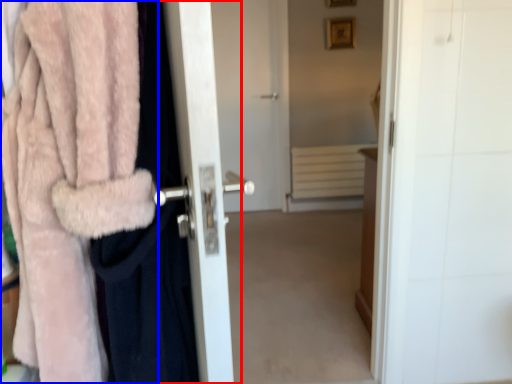
Question: Which point is closer to the camera, screen door (highlighted by a red box) or towel (highlighted by a blue box)?

Choices:
 (A) screen door
 (B) towel

Answer: (B)